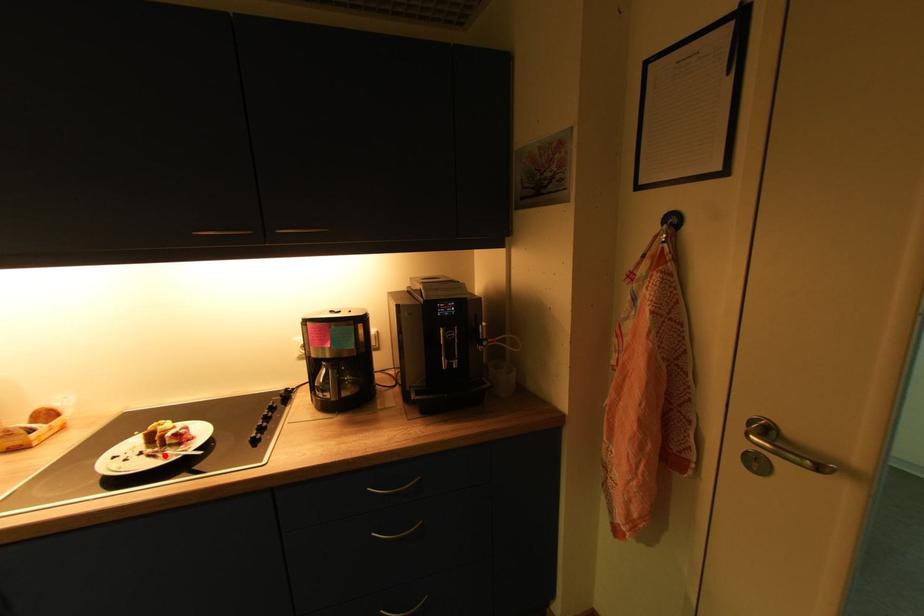
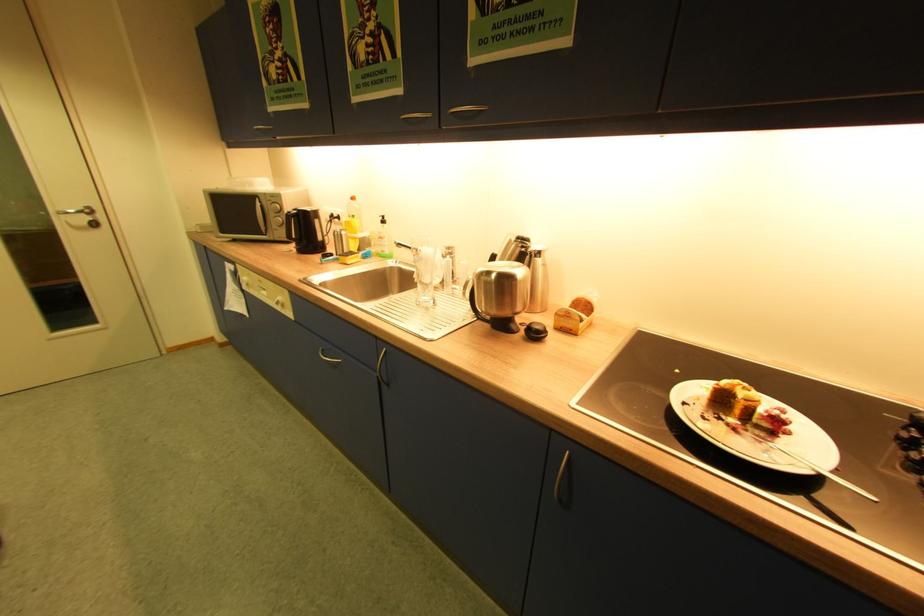
Where in the second image is the point corresponding to the highlighted location from the first image?

(746, 432)